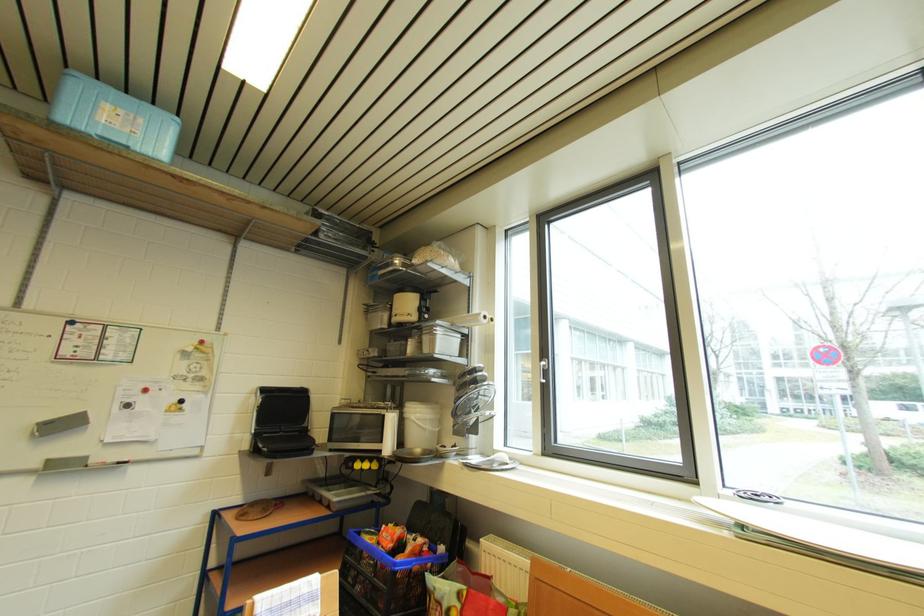
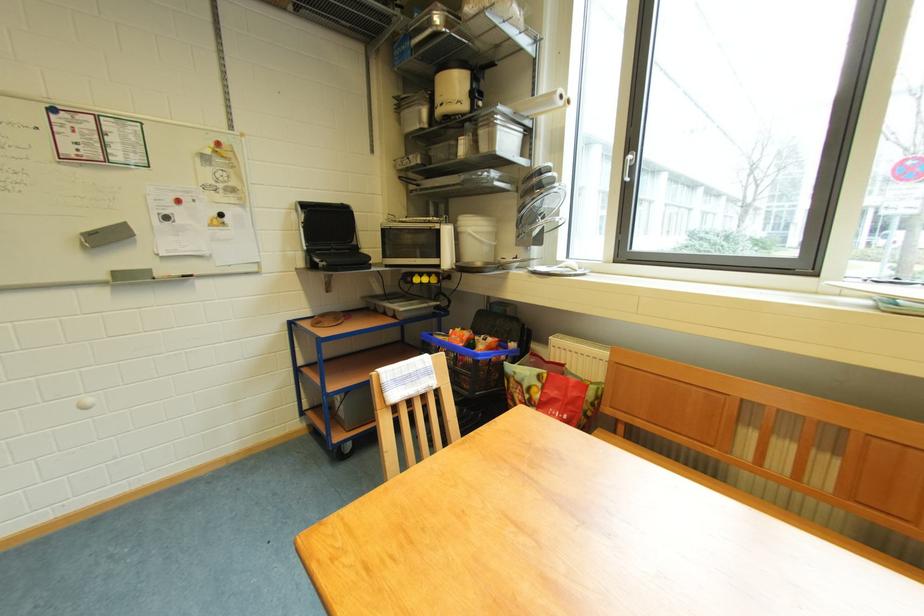
Locate, in the second image, the point that corresponds to [421,293] in the first image.

(469, 68)